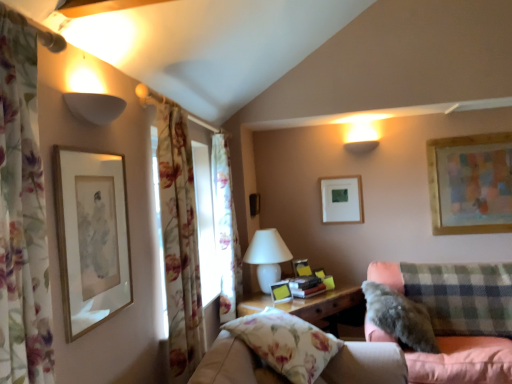
Question: From a real-world perspective, is fluffy gray pillow at lower right above or below white matte picture frame at upper center, the 1th picture frame when ordered from back to front?

Choices:
 (A) below
 (B) above

Answer: (A)

Question: Looking at their shapes, would you say fluffy gray pillow at lower right is wider or thinner than white matte picture frame at upper center, which is counted as the fourth picture frame, starting from the front?

Choices:
 (A) thin
 (B) wide

Answer: (B)

Question: Estimate the real-world distances between objects in this image. Which object is farther from the white matte picture frame at upper center, which is counted as the fourth picture frame, starting from the front?

Choices:
 (A) floral fabric curtain at center, marked as the first curtain in a back-to-front arrangement
 (B) floral fabric pillow at lower center, which appears as the 2th studio couch when viewed from the right
 (C) white matte lampshade at upper left
 (D) floral fabric curtain at left, the third curtain positioned from the back
 (E) plaid fabric couch at lower right, marked as the second studio couch in a front-to-back arrangement

Answer: (D)

Question: Based on their relative distances, which object is farther from the plaid fabric couch at lower right, marked as the second studio couch in a front-to-back arrangement?

Choices:
 (A) gold-framed artwork at upper left, which appears as the 4th picture frame when viewed from the back
 (B) wooden-framed artwork at upper right, which ranks as the fourth picture frame in left-to-right order
 (C) white matte picture frame at upper center, which is counted as the fourth picture frame, starting from the front
 (D) matte yellow picture frame at center, acting as the 2th picture frame starting from the left
 (E) floral fabric curtain at left, which is the 1th curtain in front-to-back order

Answer: (E)